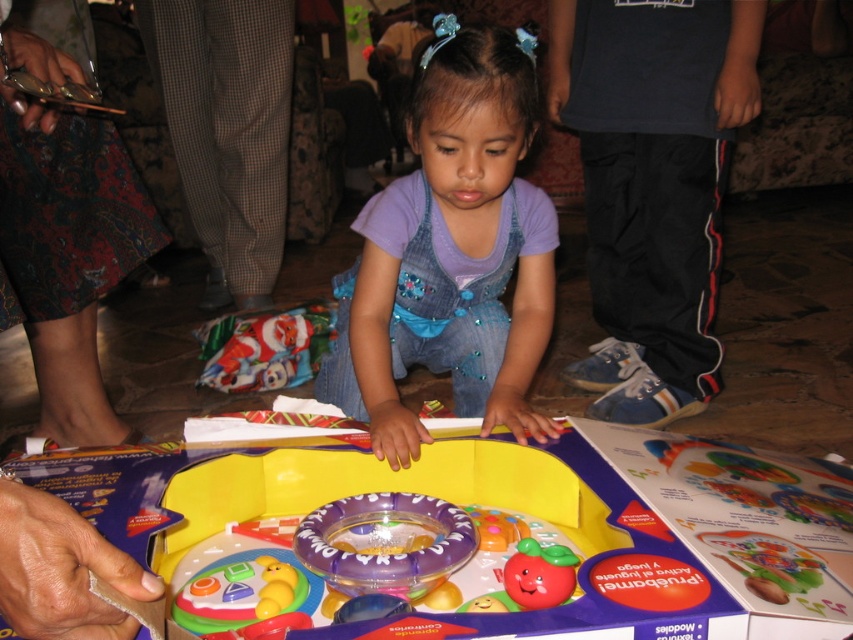
Who is more forward, [10,186] or [570,566]?

Point [570,566] is more forward.

Is point (90, 147) more distant than point (527, 602)?

Yes.

You are a GUI agent. You are given a task and a screenshot of the screen. Output one action in this format:
    pyautogui.click(x=<x>, y=<y>)
    Task: Click on the printed fabric skirt at lower left
    The height and width of the screenshot is (640, 853).
    Given the screenshot: What is the action you would take?
    (67, 252)

Between plastic toy at center and santa claus wrapping paper at lower center, which one has less height?

With less height is plastic toy at center.

Between plastic toy at center and santa claus wrapping paper at lower center, which one is positioned lower?

plastic toy at center is lower down.

Is point (181, 588) farther from camera compared to point (254, 388)?

No, (181, 588) is in front of (254, 388).

You are a GUI agent. You are given a task and a screenshot of the screen. Output one action in this format:
    pyautogui.click(x=<x>, y=<y>)
    Task: Click on the plastic toy at center
    This screenshot has height=640, width=853.
    Given the screenshot: What is the action you would take?
    pyautogui.click(x=492, y=532)

Can you confirm if denim overalls at center is smaller than printed fabric skirt at lower left?

Incorrect, denim overalls at center is not smaller in size than printed fabric skirt at lower left.

Between denim overalls at center and printed fabric skirt at lower left, which one has less height?

Standing shorter between the two is printed fabric skirt at lower left.

Describe the element at coordinates (451, 252) in the screenshot. The height and width of the screenshot is (640, 853). I see `denim overalls at center` at that location.

At what (x,y) coordinates should I click in order to perform the action: click on denim overalls at center. Please return your answer as a coordinate pair (x, y). The image size is (853, 640). Looking at the image, I should click on (451, 252).